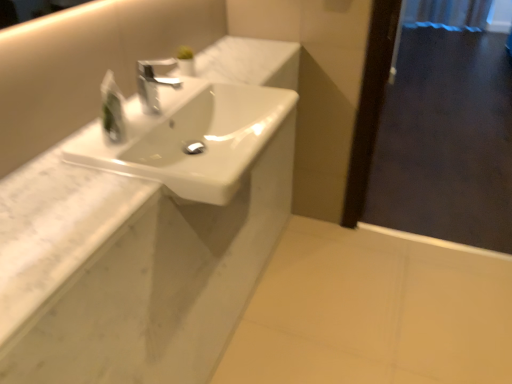
Question: Is satin nickel faucet at center wider or thinner than translucent plastic soap dispenser at upper left?

Choices:
 (A) thin
 (B) wide

Answer: (B)

Question: Is satin nickel faucet at center to the left or to the right of translucent plastic soap dispenser at upper left in the image?

Choices:
 (A) left
 (B) right

Answer: (B)

Question: Estimate the real-world distances between objects in this image. Which object is farther from the white glossy sink at center?

Choices:
 (A) white marble counter at upper left
 (B) transparent glass screen door at right
 (C) translucent plastic soap dispenser at upper left
 (D) satin nickel faucet at center

Answer: (B)

Question: Which object is the closest to the white marble counter at upper left?

Choices:
 (A) satin nickel faucet at center
 (B) translucent plastic soap dispenser at upper left
 (C) transparent glass screen door at right
 (D) white glossy sink at center

Answer: (D)